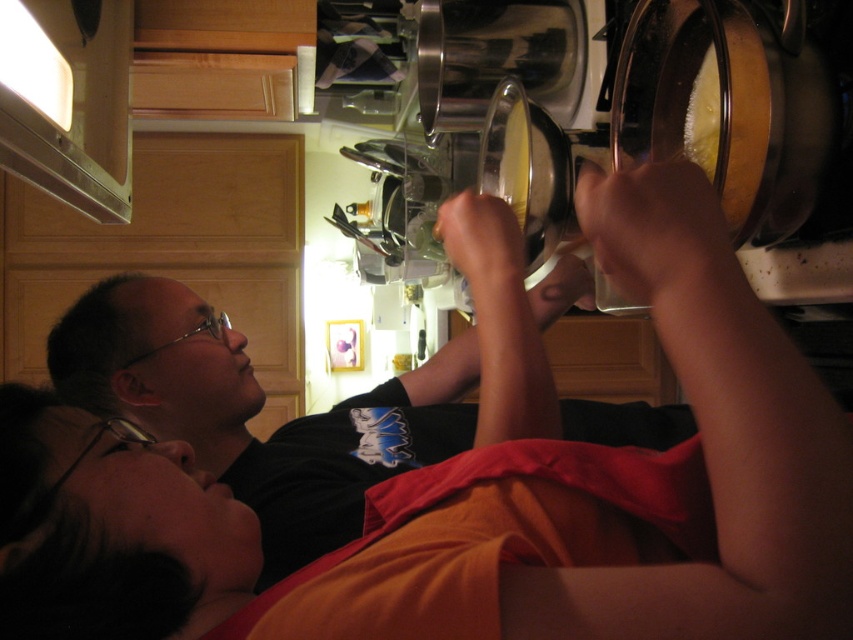
Question: From the image, what is the correct spatial relationship of metallic silver exhaust hood at upper left in relation to yellow creamy food at upper right?

Choices:
 (A) left
 (B) right

Answer: (A)

Question: Among these objects, which one is nearest to the camera?

Choices:
 (A) metallic silver exhaust hood at upper left
 (B) yellow creamy food at upper right

Answer: (B)

Question: Is black matte shirt at upper left positioned at the back of metallic silver exhaust hood at upper left?

Choices:
 (A) no
 (B) yes

Answer: (A)

Question: Does black matte shirt at upper left have a lesser width compared to yellow creamy food at upper right?

Choices:
 (A) no
 (B) yes

Answer: (A)

Question: Which point is farther to the camera?

Choices:
 (A) (709, 179)
 (B) (74, 160)

Answer: (B)

Question: Which of the following is the closest to the observer?

Choices:
 (A) metallic silver exhaust hood at upper left
 (B) black matte shirt at upper left
 (C) yellow creamy food at upper right

Answer: (C)